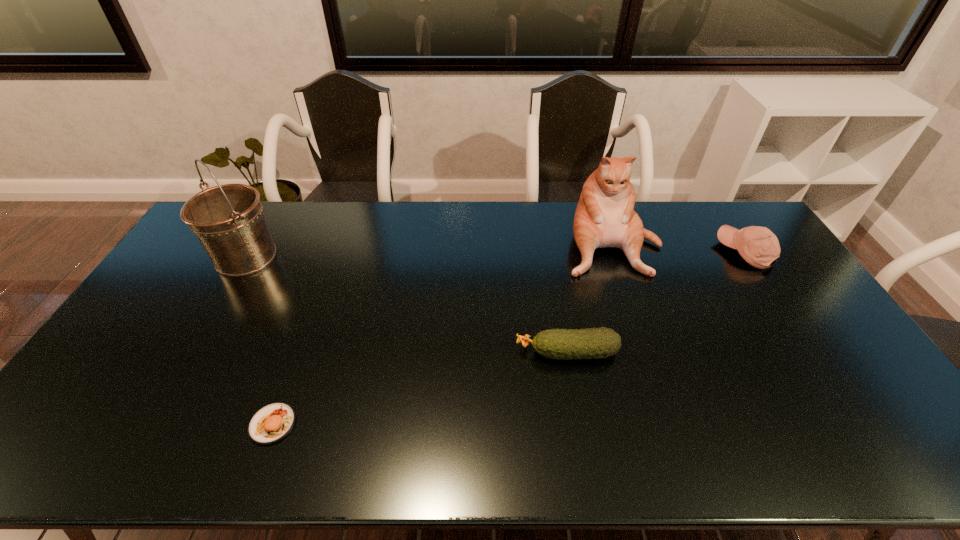
The width and height of the screenshot is (960, 540). Identify the location of free space located on the front-facing side of the baseball cap. 671,252.

Where is `vacant space located 0.250m on the front-facing side of the baseball cap`? vacant space located 0.250m on the front-facing side of the baseball cap is located at coordinates (648, 252).

This screenshot has height=540, width=960. I want to click on vacant position located on the front-facing side of the baseball cap, so click(622, 252).

This screenshot has width=960, height=540. What are the coordinates of `blank area located at the blossom end of the second shortest object` in the screenshot? It's located at (466, 352).

Where is `vacant space located 0.290m at the blossom end of the second shortest object`? Image resolution: width=960 pixels, height=540 pixels. vacant space located 0.290m at the blossom end of the second shortest object is located at coordinates (412, 352).

Identify the location of vacant area situated 0.270m at the blossom end of the second shortest object. The image size is (960, 540). (419, 352).

The image size is (960, 540). What are the coordinates of `free space located on the left of the fourth object from right to left` in the screenshot? It's located at (131, 424).

Locate an element on the screen. This screenshot has width=960, height=540. bucket positioned at the far edge is located at coordinates (228, 220).

The width and height of the screenshot is (960, 540). Find the location of `cat that is at the far edge`. cat that is at the far edge is located at coordinates (604, 217).

Image resolution: width=960 pixels, height=540 pixels. Find the location of `baseball cap positioned at the far edge`. baseball cap positioned at the far edge is located at coordinates (758, 246).